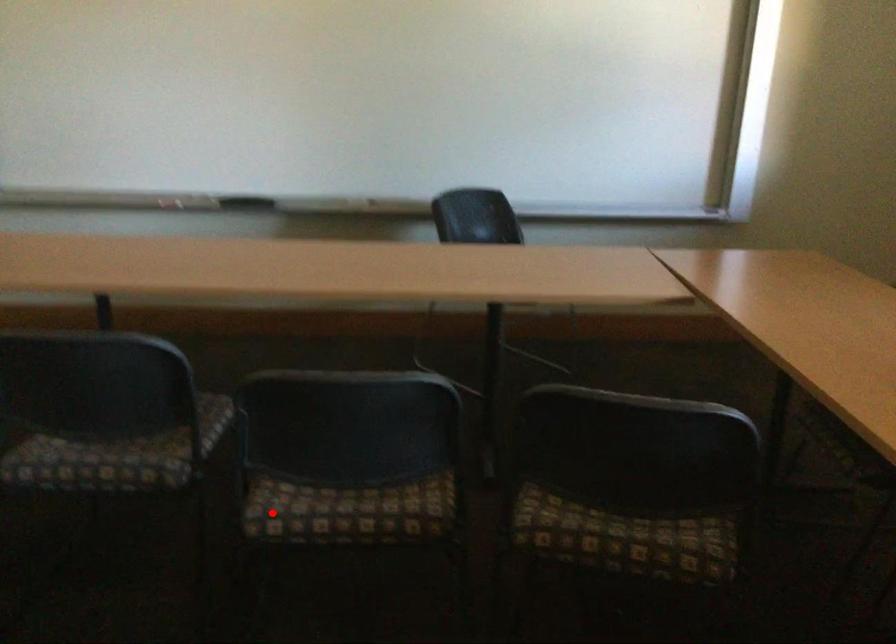
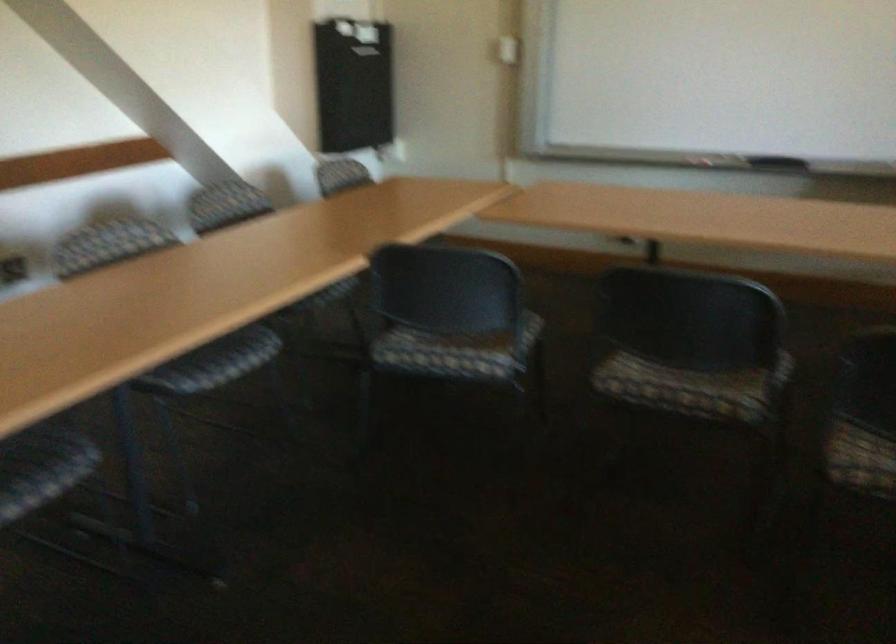
The point at the highlighted location is marked in the first image. Where is the corresponding point in the second image?

(858, 456)